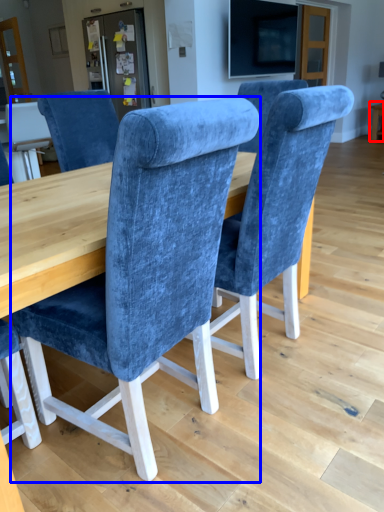
Question: Which object appears closest to the camera in this image, table (highlighted by a red box) or chair (highlighted by a blue box)?

Choices:
 (A) table
 (B) chair

Answer: (B)